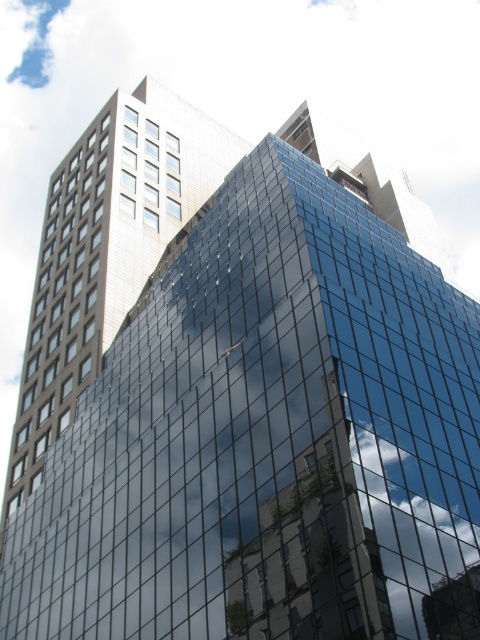
In the scene shown: You are a window cleaner with a ladder that can extend to 8 meters. You need to clean the clear glass windows at left and the white glass windows at upper left. Can you safely reach both sets of windows with your ladder? Please explain your reasoning.

The distance between the clear glass windows at left and the white glass windows at upper left is 8.81 meters. Since your ladder can only extend to 8 meters, you cannot safely reach the white glass windows at upper left as they are beyond the ladder length.

You are standing outside the modern high rise building and see the point at coordinate (64, 301). What is the purpose of this point?

The point at coordinate (64, 301) indicates clear glass windows at left.

You are an architect evaluating the building facade. You notice the clear glass windows at left and the white glass windows at upper left. Which of these two windows has a greater height?

The clear glass windows at left is taller than the white glass windows at upper left, so the clear glass windows at left has a greater height.